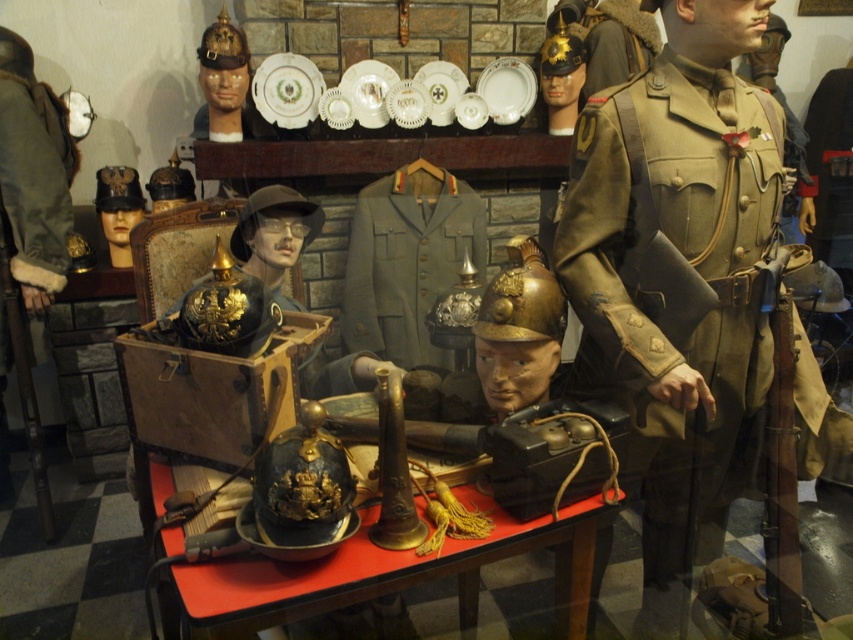
Looking at this image, which of these two, shiny black helmet at center or light olive-green fabric uniform at center, stands shorter?

With less height is shiny black helmet at center.

Identify the location of shiny black helmet at center. (393, 572).

Does khaki woolen uniform at center come behind light olive-green fabric uniform at center?

No, it is not.

Measure the distance from khaki woolen uniform at center to light olive-green fabric uniform at center.

They are 1.14 meters apart.

This screenshot has width=853, height=640. What do you see at coordinates (674, 282) in the screenshot?
I see `khaki woolen uniform at center` at bounding box center [674, 282].

Image resolution: width=853 pixels, height=640 pixels. Identify the location of khaki woolen uniform at center. (674, 282).

Is khaki woolen uniform at center positioned before shiny black helmet at center?

No, it is behind shiny black helmet at center.

Between point (685, 305) and point (207, 611), which one is positioned behind?

The point (685, 305) is behind.

Locate an element on the screen. The image size is (853, 640). khaki woolen uniform at center is located at coordinates tap(674, 282).

Identify the location of khaki woolen uniform at center. This screenshot has height=640, width=853. (674, 282).